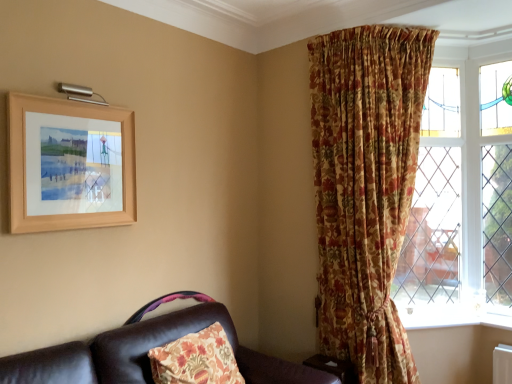
Question: From the image's perspective, is floral fabric curtain at upper right over white painted wood at lower right?

Choices:
 (A) yes
 (B) no

Answer: (A)

Question: Is floral fabric curtain at upper right next to white painted wood at lower right?

Choices:
 (A) no
 (B) yes

Answer: (A)

Question: Is white painted wood at lower right at the back of floral fabric curtain at upper right?

Choices:
 (A) no
 (B) yes

Answer: (B)

Question: Is floral fabric curtain at upper right far away from white painted wood at lower right?

Choices:
 (A) no
 (B) yes

Answer: (A)

Question: Is the position of floral fabric curtain at upper right more distant than that of white painted wood at lower right?

Choices:
 (A) yes
 (B) no

Answer: (B)

Question: Does floral fabric curtain at upper right have a lesser height compared to white painted wood at lower right?

Choices:
 (A) no
 (B) yes

Answer: (A)

Question: Is white painted wood at lower right facing towards wooden frame at upper left?

Choices:
 (A) yes
 (B) no

Answer: (B)

Question: Considering the relative sizes of white painted wood at lower right and wooden frame at upper left in the image provided, is white painted wood at lower right thinner than wooden frame at upper left?

Choices:
 (A) no
 (B) yes

Answer: (A)

Question: Does white painted wood at lower right appear on the right side of wooden frame at upper left?

Choices:
 (A) no
 (B) yes

Answer: (B)

Question: Is white painted wood at lower right located outside wooden frame at upper left?

Choices:
 (A) yes
 (B) no

Answer: (A)

Question: Is white painted wood at lower right positioned with its back to wooden frame at upper left?

Choices:
 (A) yes
 (B) no

Answer: (B)

Question: Does white painted wood at lower right have a greater width compared to wooden frame at upper left?

Choices:
 (A) no
 (B) yes

Answer: (B)

Question: Is floral fabric curtain at upper right oriented towards leather couch at lower left?

Choices:
 (A) yes
 (B) no

Answer: (B)